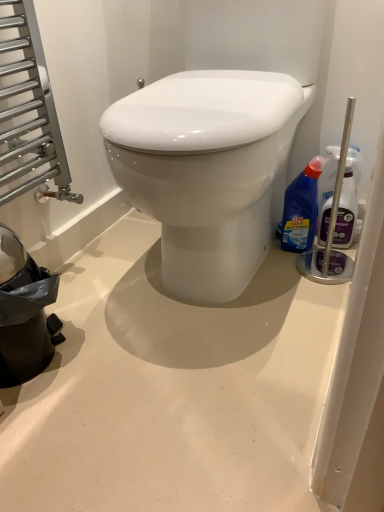
Locate an element on the screen. This screenshot has height=512, width=384. vacant region in front of purple plastic cleaner at right, acting as the 2th bottle starting from the left is located at coordinates (326, 280).